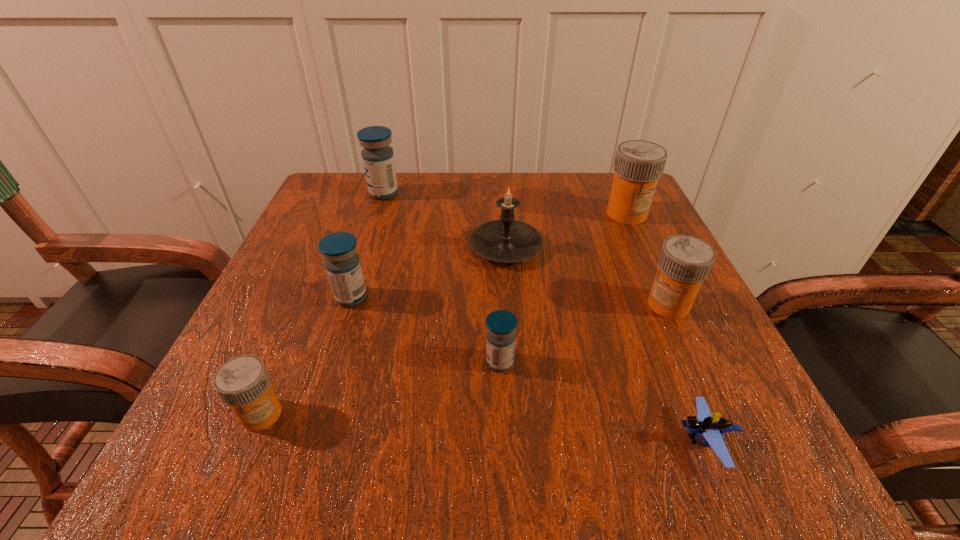
What are the coordinates of `object positioned at the far right corner` in the screenshot? It's located at (638, 165).

Find the location of a particular element. object at the near right corner is located at coordinates (711, 428).

Identify the location of vacant space at the far edge of the desktop. (403, 224).

Find the location of a particular element. The image size is (960, 540). vacant space at the near edge of the desktop is located at coordinates (593, 453).

Locate an element on the screen. This screenshot has height=540, width=960. vacant space at the left edge is located at coordinates (313, 320).

Where is `free spot at the right edge of the desktop`? free spot at the right edge of the desktop is located at coordinates (659, 248).

At what (x,y) coordinates should I click in order to perform the action: click on blank space at the far left corner of the desktop. Please return your answer as a coordinate pair (x, y). Image resolution: width=960 pixels, height=540 pixels. Looking at the image, I should click on (348, 174).

At what (x,y) coordinates should I click in order to perform the action: click on free space at the near left corner of the desktop. Please return your answer as a coordinate pair (x, y). The image size is (960, 540). Looking at the image, I should click on (295, 433).

At what (x,y) coordinates should I click in order to perform the action: click on blank space at the far right corner of the desktop. Please return your answer as a coordinate pair (x, y). The height and width of the screenshot is (540, 960). Looking at the image, I should click on (629, 225).

Locate an element on the screen. The width and height of the screenshot is (960, 540). vacant space that is in between the second biggest blue medicine and the candle is located at coordinates (428, 273).